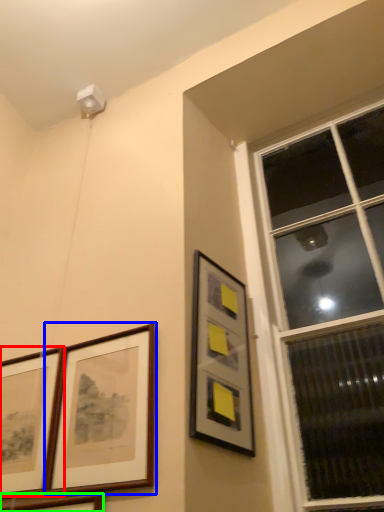
Question: Which object is positioned farthest from picture frame (highlighted by a red box)? Select from picture frame (highlighted by a blue box) and picture frame (highlighted by a green box).

Choices:
 (A) picture frame
 (B) picture frame

Answer: (B)